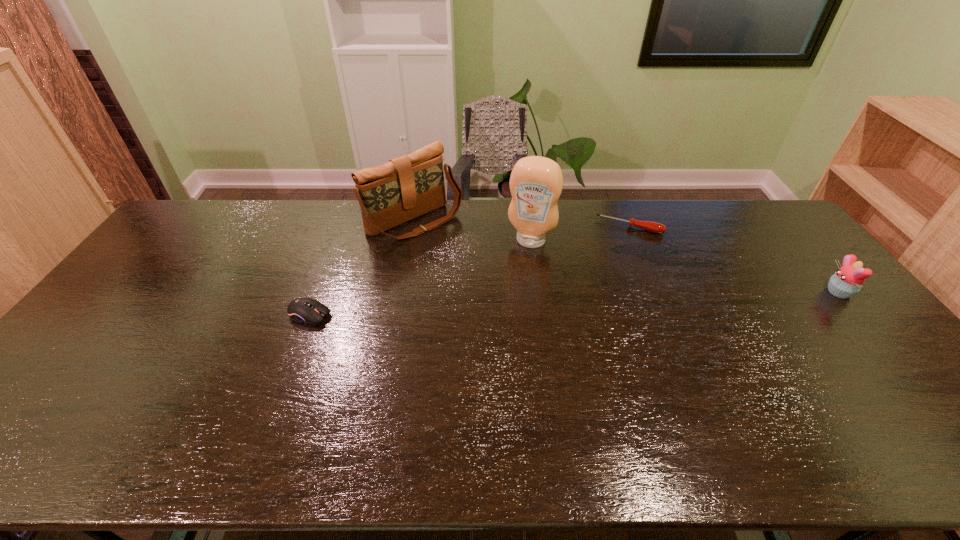
I want to click on vacant space situated on the back of the second shortest object, so click(x=337, y=243).

You are a GUI agent. You are given a task and a screenshot of the screen. Output one action in this format:
    pyautogui.click(x=<x>, y=<y>)
    Task: Click on the vacant space located on the face of the rightmost object
    The width and height of the screenshot is (960, 540).
    Given the screenshot: What is the action you would take?
    pyautogui.click(x=756, y=292)

Image resolution: width=960 pixels, height=540 pixels. What are the coordinates of `vacant space located on the face of the rightmost object` in the screenshot? It's located at (735, 292).

Find the location of a particular element. free space located on the face of the rightmost object is located at coordinates (712, 292).

Where is `vacant space located 0.360m on the front-facing side of the shoulder bag`? Image resolution: width=960 pixels, height=540 pixels. vacant space located 0.360m on the front-facing side of the shoulder bag is located at coordinates (514, 299).

The image size is (960, 540). Find the location of `vacant region located 0.280m on the front-facing side of the shoulder bag`. vacant region located 0.280m on the front-facing side of the shoulder bag is located at coordinates (496, 285).

You are a GUI agent. You are given a task and a screenshot of the screen. Output one action in this format:
    pyautogui.click(x=<x>, y=<y>)
    Task: Click on the free space located on the front-facing side of the shoulder bag
    The height and width of the screenshot is (540, 960).
    Given the screenshot: What is the action you would take?
    pyautogui.click(x=496, y=285)

Where is `vacant space situated 0.210m at the tip of the shortest object`? vacant space situated 0.210m at the tip of the shortest object is located at coordinates (609, 273).

Find the location of a particular element. free space located at the tip of the shortest object is located at coordinates (614, 256).

Find the location of `free space located at the tip of the shortest object`. free space located at the tip of the shortest object is located at coordinates (600, 301).